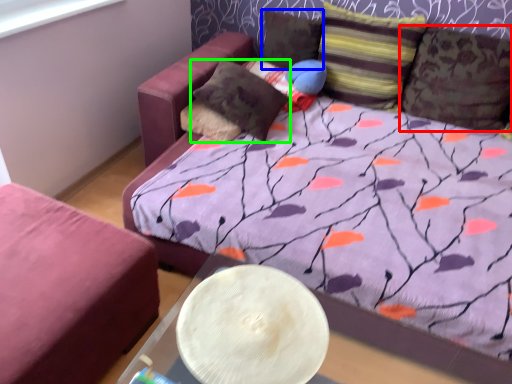
Question: Which object is the closest to the pillow (highlighted by a red box)? Choose among these: pillow (highlighted by a blue box) or pillow (highlighted by a green box).

Choices:
 (A) pillow
 (B) pillow

Answer: (A)